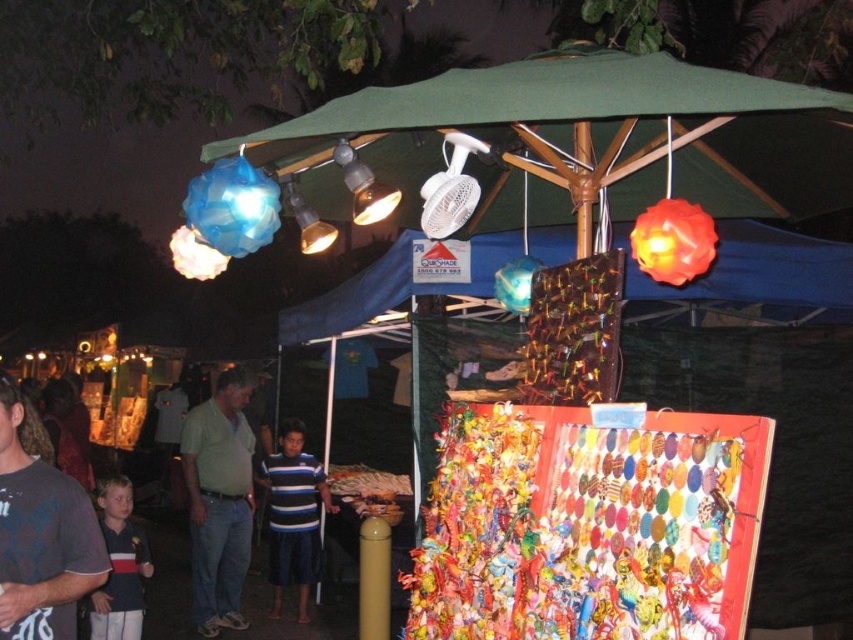
Identify the location of matte gray shirt at center. (41, 538).

Who is more forward, (62, 616) or (264, 477)?

Point (62, 616) is more forward.

This screenshot has width=853, height=640. What do you see at coordinates (41, 538) in the screenshot?
I see `matte gray shirt at center` at bounding box center [41, 538].

You are a GUI agent. You are given a task and a screenshot of the screen. Output one action in this format:
    pyautogui.click(x=<x>, y=<y>)
    Task: Click on the matte gray shirt at center
    
    Given the screenshot: What is the action you would take?
    pyautogui.click(x=41, y=538)

Between green cotton shirt at center and blue striped shirt at center, which one has more height?

green cotton shirt at center

Does green cotton shirt at center appear under blue striped shirt at center?

Actually, green cotton shirt at center is above blue striped shirt at center.

Between point (207, 416) and point (308, 548), which one is positioned behind?

Point (308, 548)

The width and height of the screenshot is (853, 640). Identify the location of green cotton shirt at center. (219, 500).

Between matte gray shirt at center and green cotton shirt at center, which one has more height?

With more height is green cotton shirt at center.

Is matte gray shirt at center positioned behind green cotton shirt at center?

That is False.

What do you see at coordinates (41, 538) in the screenshot? This screenshot has width=853, height=640. I see `matte gray shirt at center` at bounding box center [41, 538].

At what (x,y) coordinates should I click in order to perform the action: click on matte gray shirt at center. Please return your answer as a coordinate pair (x, y). This screenshot has width=853, height=640. Looking at the image, I should click on [x=41, y=538].